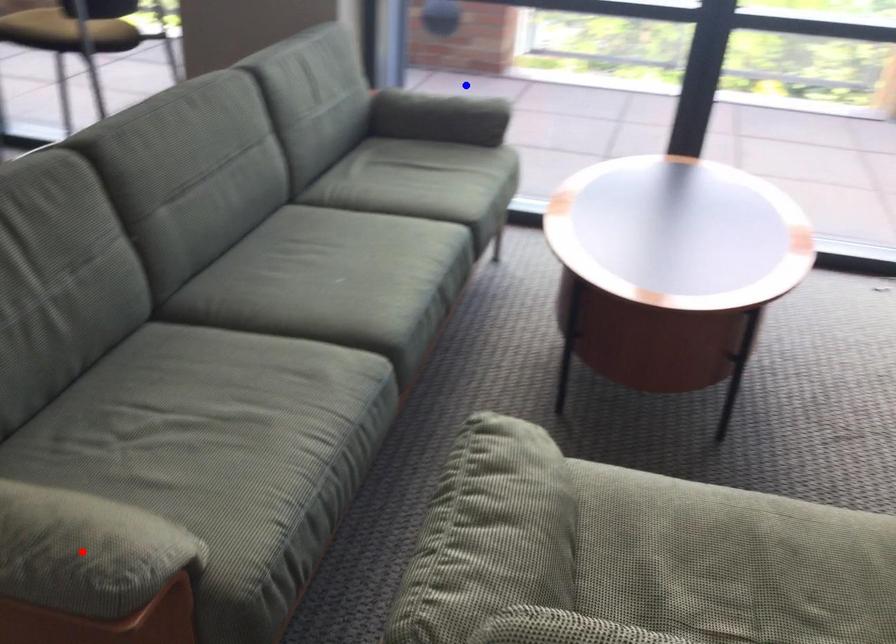
Question: Two points are marked on the image. Which point is closer to the camera?

Choices:
 (A) Blue point is closer.
 (B) Red point is closer.

Answer: (B)